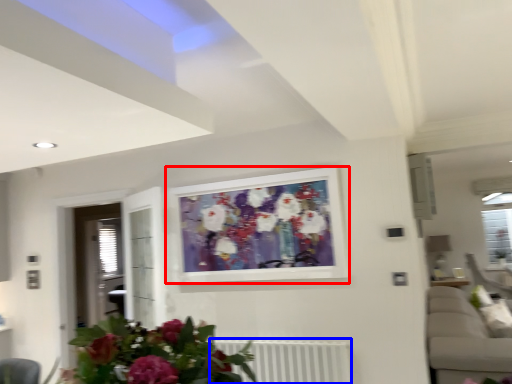
Question: Among these objects, which one is nearest to the camera, picture frame (highlighted by a red box) or radiator (highlighted by a blue box)?

Choices:
 (A) picture frame
 (B) radiator

Answer: (B)